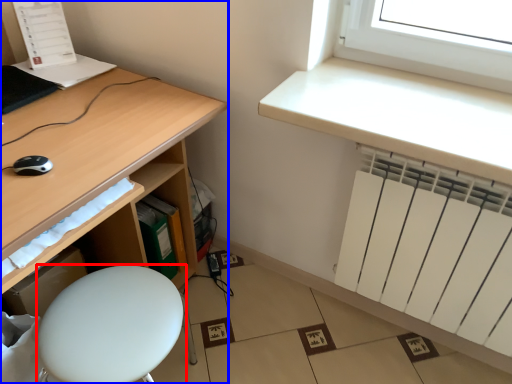
Question: Which point is further to the camera, furniture (highlighted by a red box) or desk (highlighted by a blue box)?

Choices:
 (A) furniture
 (B) desk

Answer: (A)